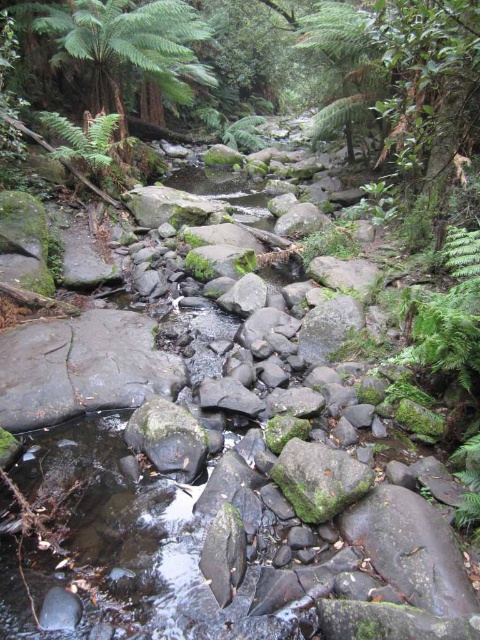
You are a hiker navigating the forest stream and need to step on the green mossy rock at center to reach the other side. Is the green fuzzy fern at upper left visible behind the rock?

Yes, the green mossy rock at center is in front of the green fuzzy fern at upper left, so the fern is visible behind the rock.

You are a hiker trying to cross the stream. You see the green mossy rock at center and the green fuzzy fern at upper left. Which object is narrower, and can you step on the narrower one safely?

The green mossy rock at center is narrower than the green fuzzy fern at upper left. Since the rock is solid, you can step on it safely while crossing the stream.